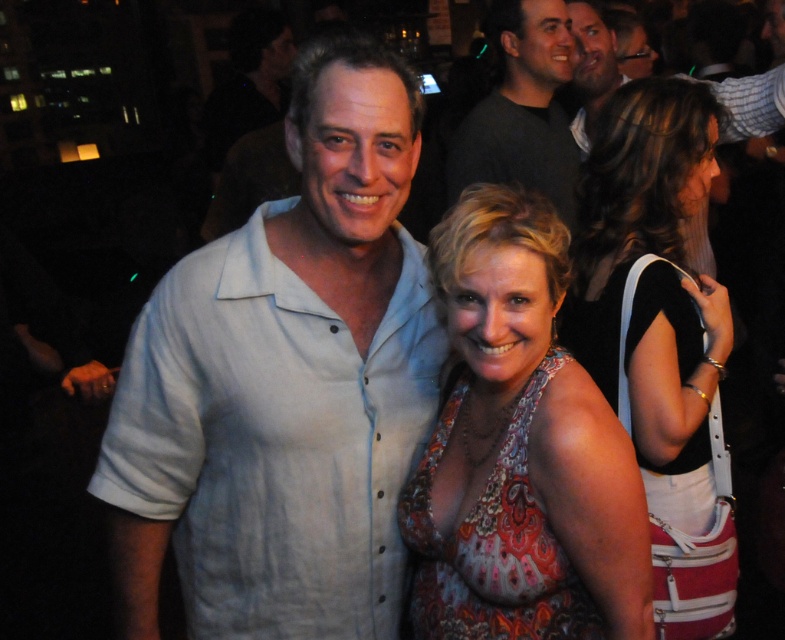
You are a photographer trying to capture a candid shot of the dark gray shirt at upper center. The camera has a focal length of 50mm and an aperture of f2.8. Given the current lighting conditions, which are dim but with some bright spots, what adjustment should you make to ensure the subject is in focus and properly exposed?

Since the dark gray shirt at upper center is positioned at point (521, 108), you should adjust the focus to that coordinate and increase the ISO to compensate for the low light, ensuring proper exposure while maintaining sharpness.

You are a photographer trying to capture a group photo of the light blue linen shirt at center and the smooth skin face at upper center. Based on their positions, which object is positioned to the right side of the other?

The smooth skin face at upper center is positioned to the right side of the light blue linen shirt at center.